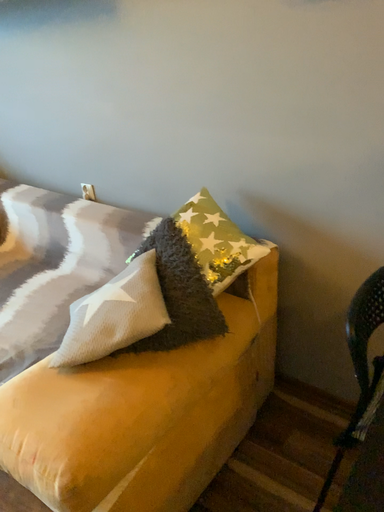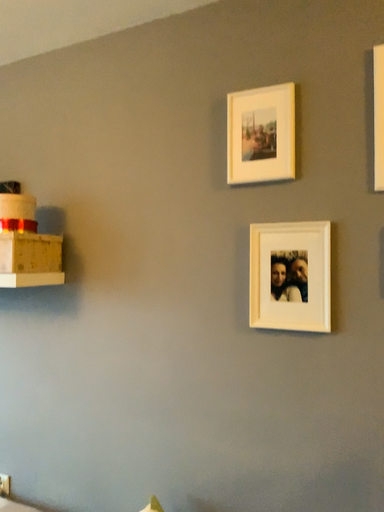
Question: How did the camera likely rotate when shooting the video?

Choices:
 (A) rotated left
 (B) rotated right

Answer: (B)